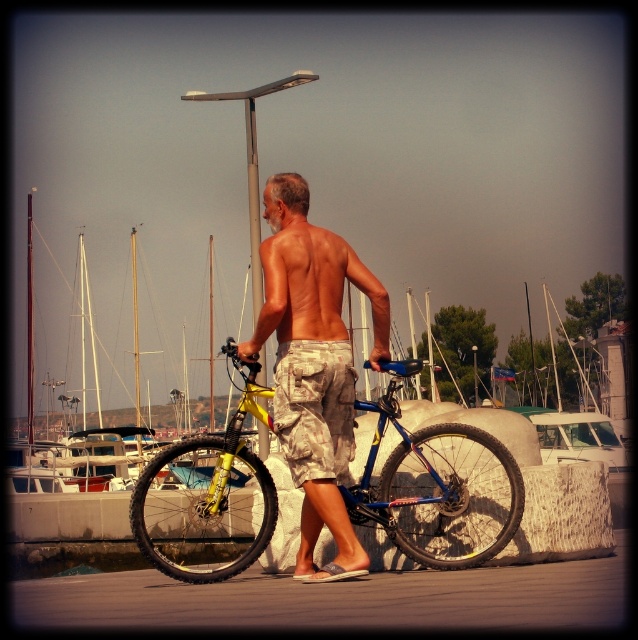
Question: Among these points, which one is farthest from the camera?

Choices:
 (A) (251, 180)
 (B) (523, 486)
 (C) (341, 284)

Answer: (A)

Question: Where is camouflage fabric shorts at center located in relation to metallic pole at center in the image?

Choices:
 (A) above
 (B) below

Answer: (B)

Question: Is yellow matte bicycle at center thinner than camouflage shorts at center?

Choices:
 (A) yes
 (B) no

Answer: (B)

Question: Considering the real-world distances, which object is closest to the camouflage fabric shorts at center?

Choices:
 (A) metallic pole at center
 (B) yellow matte bicycle at center
 (C) muscular tan skin at back

Answer: (C)

Question: Which object is the closest to the camouflage shorts at center?

Choices:
 (A) muscular tan skin at back
 (B) metallic pole at center

Answer: (A)

Question: Is camouflage shorts at center to the right of camouflage fabric shorts at center from the viewer's perspective?

Choices:
 (A) yes
 (B) no

Answer: (B)